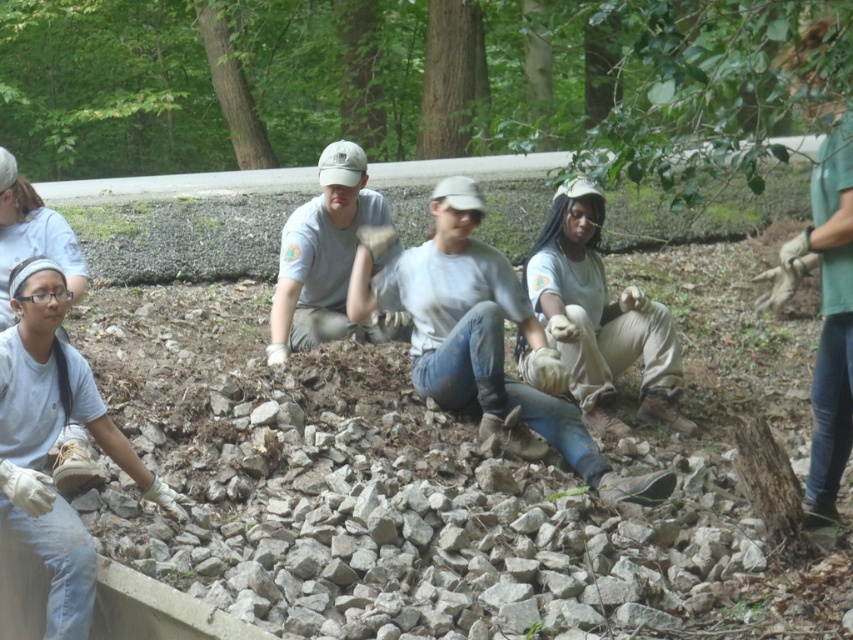
Between light brown fabric gloves at center and matte gray shirt at center, which one is positioned higher?

matte gray shirt at center

Which is more to the left, light brown fabric gloves at center or matte gray shirt at center?

matte gray shirt at center

Does point (622, 305) lie behind point (351, 225)?

No.

Find the location of `light brown fabric gloves at center`. light brown fabric gloves at center is located at coordinates (601, 317).

Can you confirm if white cotton shirt at center is positioned below light brown fabric gloves at center?

Actually, white cotton shirt at center is above light brown fabric gloves at center.

Which is below, white cotton shirt at center or light brown fabric gloves at center?

light brown fabric gloves at center is below.

Where is `white cotton shirt at center`? This screenshot has width=853, height=640. white cotton shirt at center is located at coordinates (480, 337).

Does point (531, 342) lie behind point (347, 268)?

No.

In the scene shown: Who is lower down, white cotton shirt at center or matte gray shirt at center?

white cotton shirt at center

Which is in front, point (465, 342) or point (283, 337)?

Point (465, 342) is in front.

Identify the location of white cotton shirt at center. The image size is (853, 640). (480, 337).